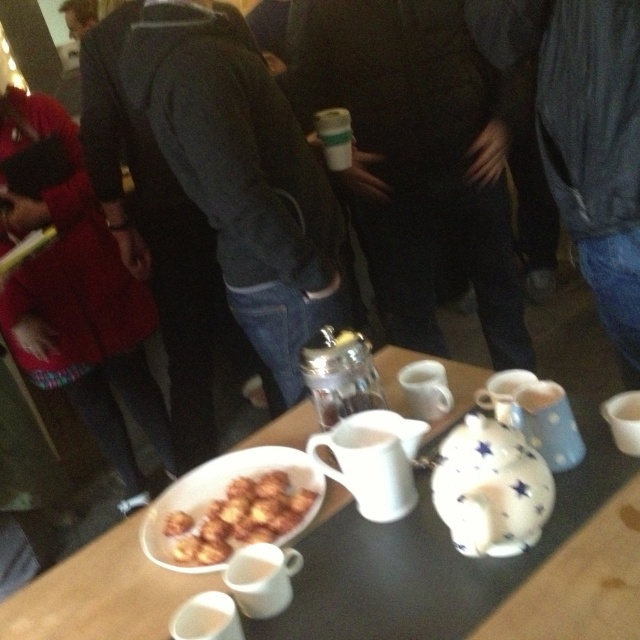
Can you confirm if wooden table at center is positioned to the right of denim jacket at center?

No, wooden table at center is not to the right of denim jacket at center.

Which is in front, point (632, 547) or point (508, 48)?

Point (632, 547) is in front.

This screenshot has height=640, width=640. Identify the location of wooden table at center. (100, 593).

Which is more to the left, matte black jacket at center or white ceramic coffee pot at center?

white ceramic coffee pot at center is more to the left.

Is point (291, 90) in front of point (342, 432)?

No, (291, 90) is further to viewer.

Is point (432, 352) more distant than point (380, 433)?

Yes, point (432, 352) is behind point (380, 433).

You are a GUI agent. You are given a task and a screenshot of the screen. Output one action in this format:
    pyautogui.click(x=<x>, y=<y>)
    Task: Click on the matte black jacket at center
    
    Given the screenshot: What is the action you would take?
    pyautogui.click(x=416, y=156)

What do you see at coordinates (416, 156) in the screenshot?
I see `matte black jacket at center` at bounding box center [416, 156].

This screenshot has height=640, width=640. Identify the location of matte black jacket at center. (416, 156).

Which is behind, point (394, 134) or point (344, 108)?

Positioned behind is point (344, 108).

Image resolution: width=640 pixels, height=640 pixels. What are the coordinates of `matte black jacket at center` in the screenshot? It's located at click(416, 156).